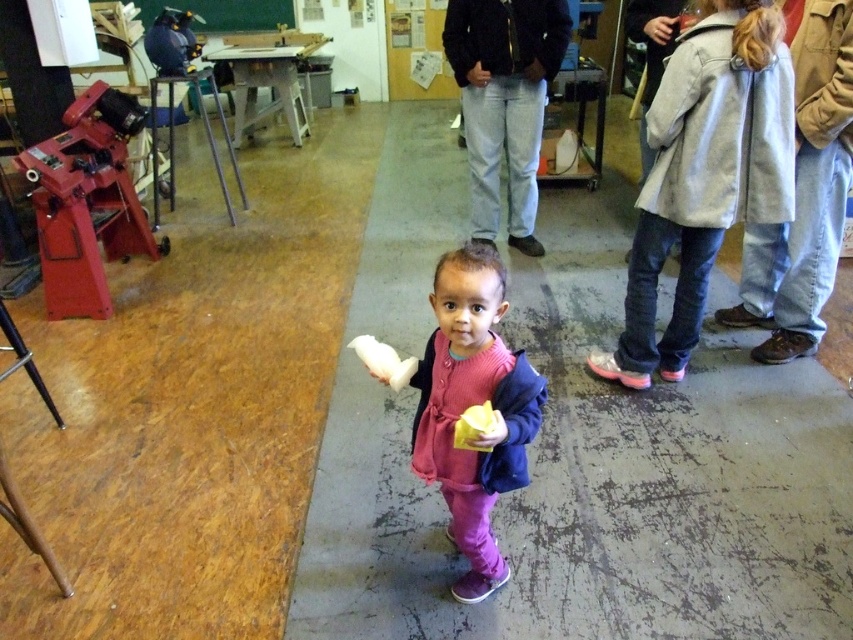
Is point (697, 211) less distant than point (451, 412)?

No, it is behind (451, 412).

Can you confirm if light gray wool coat at right is taller than pink fleece sweater at center?

Indeed, light gray wool coat at right has a greater height compared to pink fleece sweater at center.

The height and width of the screenshot is (640, 853). Describe the element at coordinates (705, 173) in the screenshot. I see `light gray wool coat at right` at that location.

Locate an element on the screen. The image size is (853, 640). light gray wool coat at right is located at coordinates (705, 173).